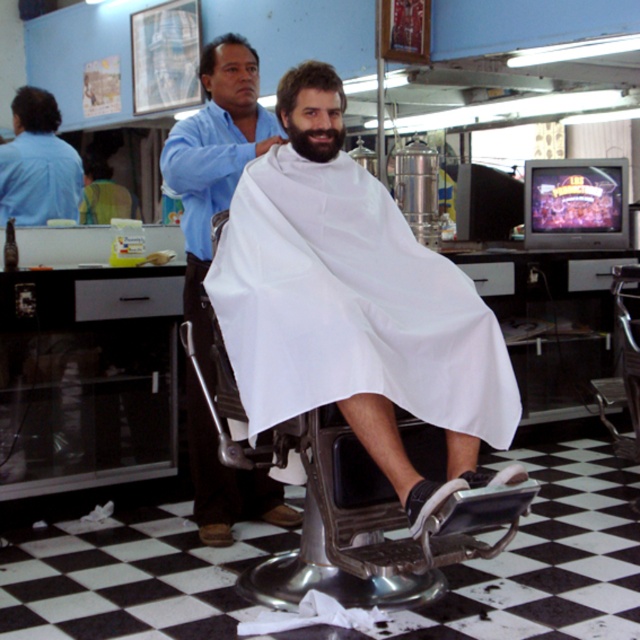
You are a customer in the barbershop and want to know which object is wider between the white matte cloth at center and the brown fuzzy beard at center. Could you tell me?

The white matte cloth at center is wider than the brown fuzzy beard at center.

You are a customer in a barbershop and see two haircuts displayed on the mannequin heads. The smooth brown hair at upper center and the brown matte hair at center. Which haircut is closer to you?

The smooth brown hair at upper center is closer to you because it is further to the viewer than the brown matte hair at center.